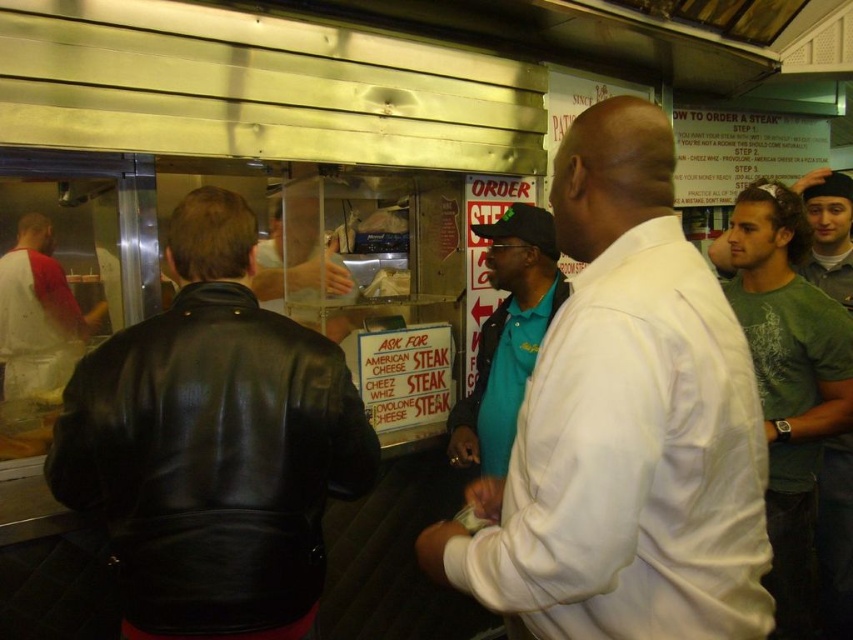
Does white matte shirt at center have a lesser height compared to green knit cap at upper right?

No, white matte shirt at center is not shorter than green knit cap at upper right.

Is white matte shirt at center behind green knit cap at upper right?

No, white matte shirt at center is closer to the viewer.

Who is more distant from viewer, (764, 515) or (849, 260)?

Positioned behind is point (849, 260).

The image size is (853, 640). What are the coordinates of `white matte shirt at center` in the screenshot? It's located at pyautogui.click(x=625, y=424).

Which of these two, black leather jacket at left or green t-shirt at right, stands shorter?

With less height is black leather jacket at left.

Between black leather jacket at left and green t-shirt at right, which one has more height?

green t-shirt at right

Who is more distant from viewer, (160, 433) or (796, 358)?

Point (796, 358)

Find the location of a particular element. This screenshot has height=640, width=853. black leather jacket at left is located at coordinates (212, 444).

Looking at this image, who is positioned more to the right, white matte shirt at center or green t-shirt at right?

From the viewer's perspective, green t-shirt at right appears more on the right side.

Is white matte shirt at center above green t-shirt at right?

Yes, white matte shirt at center is above green t-shirt at right.

Is point (732, 593) positioned in front of point (802, 449)?

Yes, it is in front of point (802, 449).

I want to click on white matte shirt at center, so click(625, 424).